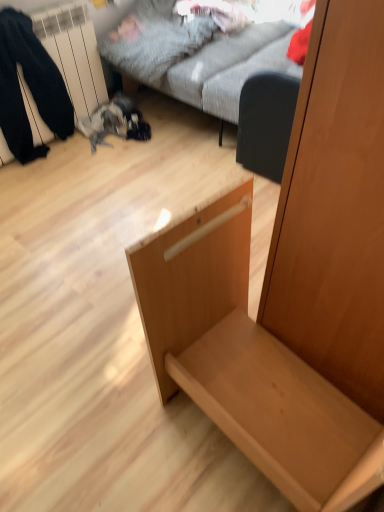
Question: Is black fabric pants at left situated inside light wood drawer at center or outside?

Choices:
 (A) inside
 (B) outside

Answer: (B)

Question: From the image's perspective, is black fabric pants at left above or below light wood drawer at center?

Choices:
 (A) below
 (B) above

Answer: (B)

Question: Considering the real-world distances, which object is farthest from the light wood drawer at center?

Choices:
 (A) black matte swivel chair at center-right
 (B) textured gray fabric couch at upper center
 (C) black fabric pants at left

Answer: (C)

Question: Based on their relative distances, which object is farther from the black fabric pants at left?

Choices:
 (A) textured gray fabric couch at upper center
 (B) black matte swivel chair at center-right
 (C) light wood drawer at center

Answer: (C)